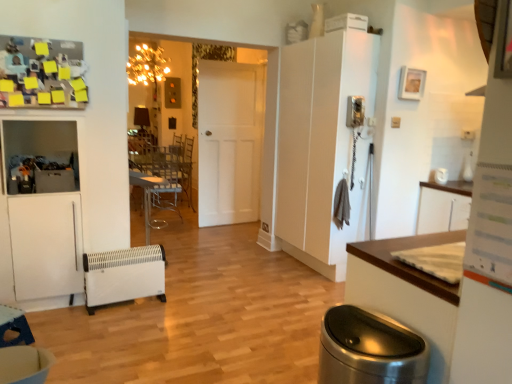
At what (x,y) coordinates should I click in order to perform the action: click on vacant area located to the right-hand side of white matte heater at lower left. Please return your answer as a coordinate pair (x, y). The image size is (512, 384). Looking at the image, I should click on (176, 309).